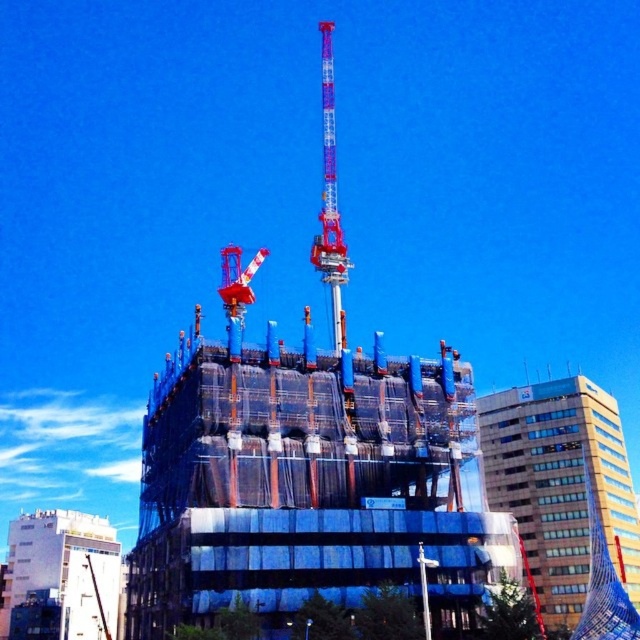
You are an inspector standing at the edge of the construction site. You notice two points marked on the image, point 1 at coordinates (99, 573) and point 2 at coordinates (321, 195). Which point is closer to you?

Point 1 at coordinates (99, 573) is closer to the viewer than point 2 at coordinates (321, 195).

You are an engineer inspecting a construction site. You notice two points marked on the blueprint at coordinates point (552,426) and point (320,269). Which point is closer to you as you stand at the observation deck?

Point (552,426) is further to the viewer than point (320,269), so the point closer to you is point (320,269).